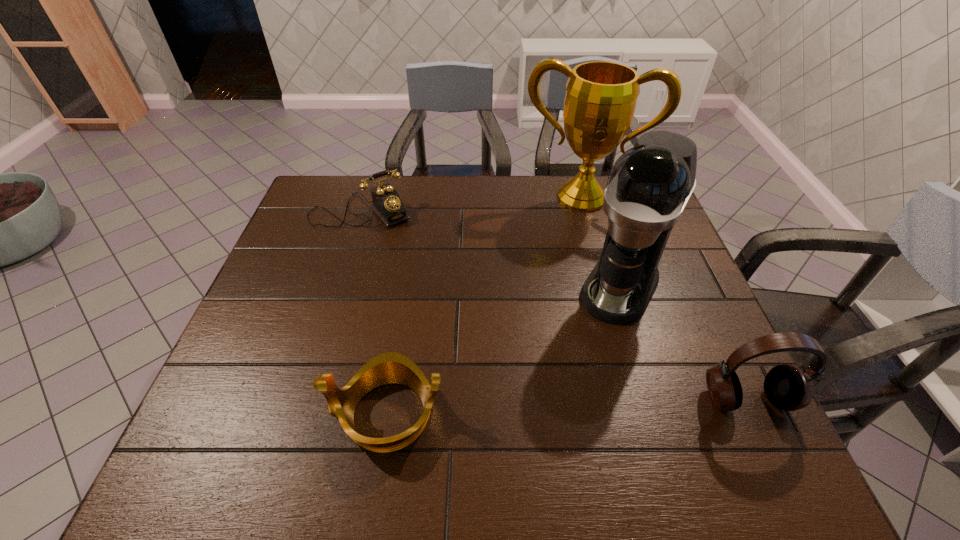
This screenshot has width=960, height=540. I want to click on headset located in the near edge section of the desktop, so pyautogui.click(x=787, y=387).

Where is `object positioned at the left edge`? object positioned at the left edge is located at coordinates (387, 204).

This screenshot has height=540, width=960. I want to click on headset located at the right edge, so click(787, 387).

At what (x,y) coordinates should I click in order to perform the action: click on coffee maker at the right edge. Please return your answer as a coordinate pair (x, y). The image size is (960, 540). Looking at the image, I should click on (649, 185).

Find the location of a particular element. This screenshot has width=960, height=540. award that is at the right edge is located at coordinates (601, 96).

Where is `object at the far left corner`? object at the far left corner is located at coordinates (387, 204).

You are a GUI agent. You are given a task and a screenshot of the screen. Output one action in this format:
    pyautogui.click(x=<x>, y=<y>)
    Task: Click on the object present at the far right corner
    The image size is (960, 540).
    Given the screenshot: What is the action you would take?
    pyautogui.click(x=601, y=96)

The width and height of the screenshot is (960, 540). Find the location of `object situated at the near right corner`. object situated at the near right corner is located at coordinates (787, 387).

In the image, there is a desktop. Where is `free space at the far edge`? free space at the far edge is located at coordinates click(x=520, y=188).

You are a GUI agent. You are given a task and a screenshot of the screen. Output one action in this format:
    pyautogui.click(x=<x>, y=<y>)
    Task: Click on the vacant space at the near edge of the desktop
    The image size is (960, 540).
    Given the screenshot: What is the action you would take?
    pyautogui.click(x=652, y=411)